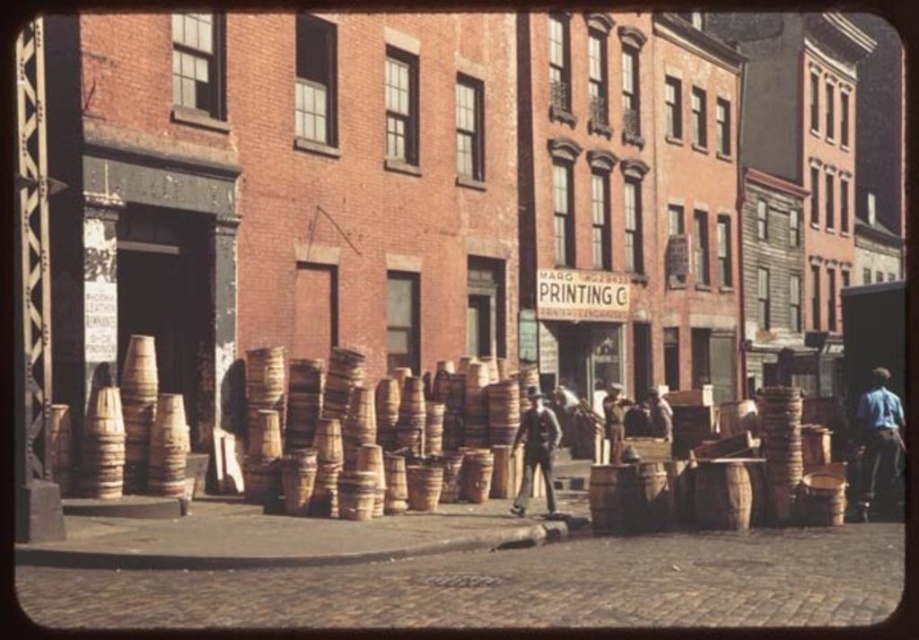
Can you confirm if blue denim shirt at right is positioned to the right of dark brown leather coat at center?

Indeed, blue denim shirt at right is positioned on the right side of dark brown leather coat at center.

Measure the distance between blue denim shirt at right and camera.

blue denim shirt at right and camera are 13.93 meters apart from each other.

At what (x,y) coordinates should I click in order to perform the action: click on blue denim shirt at right. Please return your answer as a coordinate pair (x, y). Looking at the image, I should click on (878, 442).

Does wooden barrel at center have a greater width compared to dark brown leather coat at center?

Yes.

Which is more to the left, wooden barrel at center or dark brown leather coat at center?

wooden barrel at center is more to the left.

Is point (473, 460) in front of point (525, 444)?

Yes, point (473, 460) is closer to viewer.

I want to click on wooden barrel at center, so click(x=386, y=433).

Does wooden barrel at center appear under blue denim shirt at right?

Actually, wooden barrel at center is above blue denim shirt at right.

Who is positioned more to the left, wooden barrel at center or blue denim shirt at right?

wooden barrel at center is more to the left.

This screenshot has height=640, width=919. Find the location of `wooden barrel at center`. wooden barrel at center is located at coordinates (386, 433).

The height and width of the screenshot is (640, 919). Find the location of `wooden barrel at center`. wooden barrel at center is located at coordinates (386, 433).